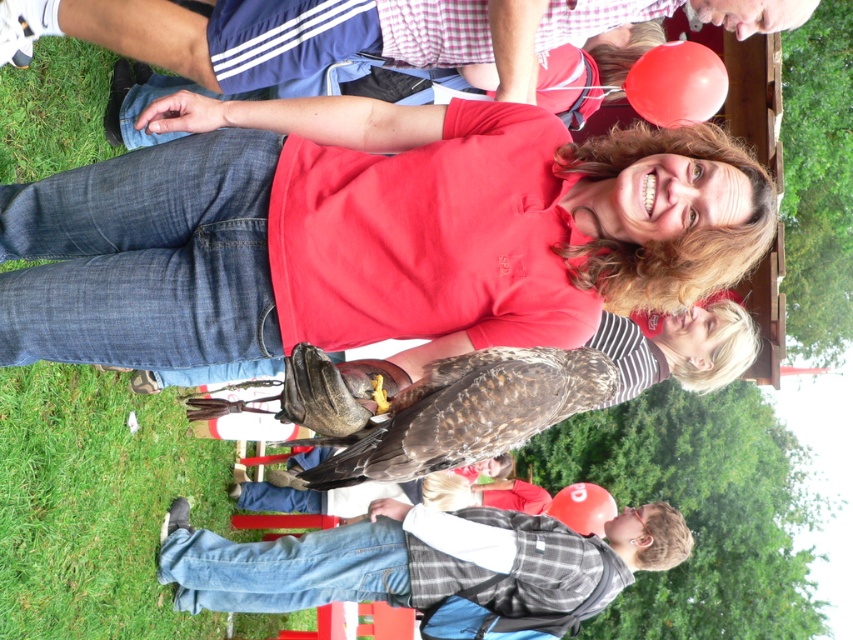
Question: Which point is farther to the camera?

Choices:
 (A) brown feathered falcon at center
 (B) denim jeans at lower left
 (C) matte brown bird at center

Answer: (B)

Question: From the image, what is the correct spatial relationship of matte brown bird at center in relation to brown feathered falcon at center?

Choices:
 (A) below
 (B) above

Answer: (B)

Question: Which point appears closest to the camera in this image?

Choices:
 (A) (527, 531)
 (B) (532, 403)
 (C) (419, 225)

Answer: (B)

Question: Can you confirm if matte brown bird at center is smaller than brown feathered falcon at center?

Choices:
 (A) no
 (B) yes

Answer: (B)

Question: Does matte brown bird at center appear on the right side of denim jeans at lower left?

Choices:
 (A) no
 (B) yes

Answer: (B)

Question: Estimate the real-world distances between objects in this image. Which object is farther from the denim jeans at lower left?

Choices:
 (A) brown feathered falcon at center
 (B) matte brown bird at center

Answer: (A)